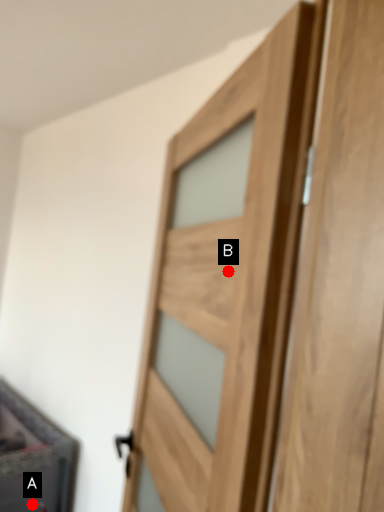
Question: Two points are circled on the image, labeled by A and B beside each circle. Which point is farther to the camera?

Choices:
 (A) A is further
 (B) B is further

Answer: (A)